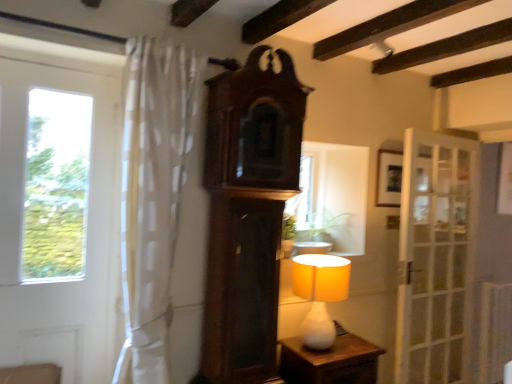
This screenshot has height=384, width=512. In order to click on free region under white matte table lamp at center (from a real-world perspective) in this screenshot , I will do `click(312, 347)`.